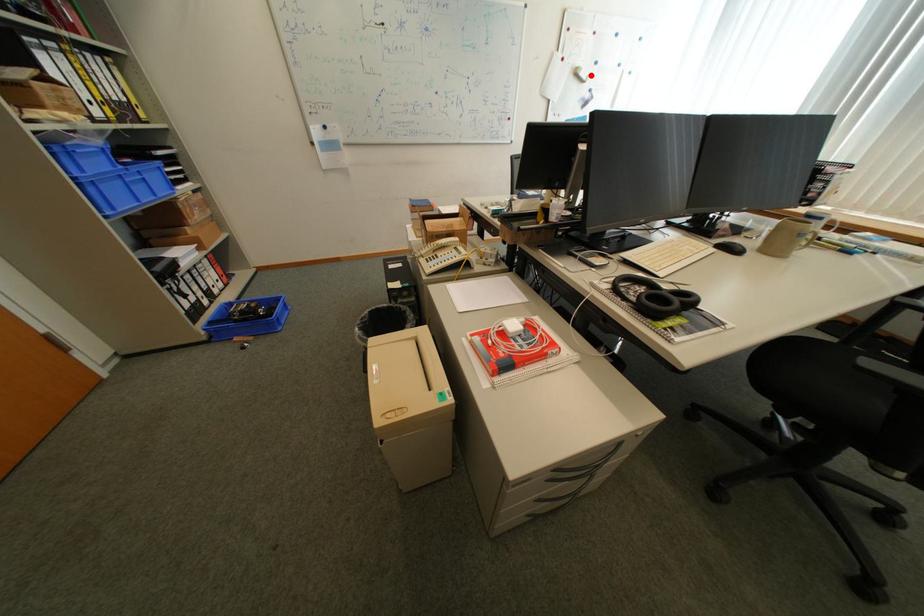
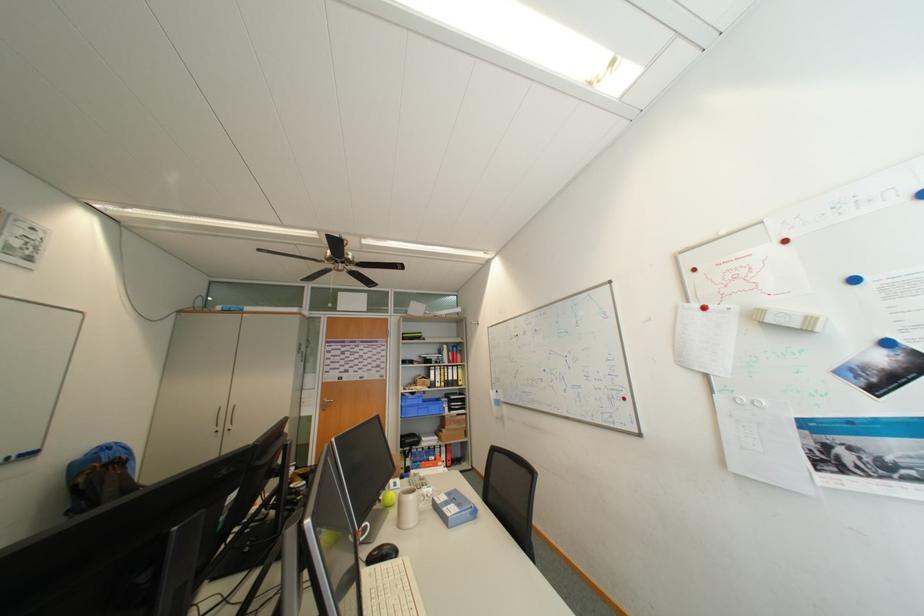
Locate, in the second image, the point that corresponds to the highlighted location in the first image.

(777, 322)